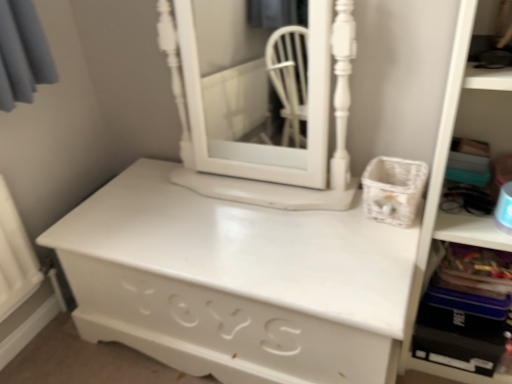
Image resolution: width=512 pixels, height=384 pixels. Find the location of `vacant area that is in front of white painted wood medicine cabinet at center`. vacant area that is in front of white painted wood medicine cabinet at center is located at coordinates (276, 240).